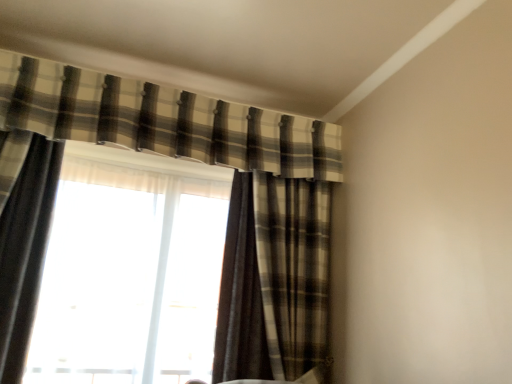
Question: Does brown plaid curtain at center, acting as the 3th curtain starting from the left, have a smaller size compared to plaid fabric curtain at left, arranged as the third curtain when viewed from the right?

Choices:
 (A) no
 (B) yes

Answer: (A)

Question: Does brown plaid curtain at center, acting as the 3th curtain starting from the left, come in front of plaid fabric curtain at left, the 1th curtain when ordered from left to right?

Choices:
 (A) yes
 (B) no

Answer: (B)

Question: Considering the relative positions of brown plaid curtain at center, acting as the 3th curtain starting from the left, and plaid fabric curtain at left, the 1th curtain when ordered from left to right, in the image provided, is brown plaid curtain at center, acting as the 3th curtain starting from the left, behind plaid fabric curtain at left, the 1th curtain when ordered from left to right,?

Choices:
 (A) yes
 (B) no

Answer: (A)

Question: Does brown plaid curtain at center, the 1th curtain when ordered from right to left, have a greater height compared to plaid fabric curtain at left, the 1th curtain when ordered from left to right?

Choices:
 (A) yes
 (B) no

Answer: (B)

Question: From a real-world perspective, is brown plaid curtain at center, acting as the 3th curtain starting from the left, under plaid fabric curtain at left, arranged as the third curtain when viewed from the right?

Choices:
 (A) yes
 (B) no

Answer: (B)

Question: Considering the positions of point (123, 180) and point (31, 208), is point (123, 180) closer or farther from the camera than point (31, 208)?

Choices:
 (A) closer
 (B) farther

Answer: (B)

Question: Considering the positions of translucent fabric at center and plaid fabric curtain at left, the 1th curtain when ordered from left to right, in the image, is translucent fabric at center bigger or smaller than plaid fabric curtain at left, the 1th curtain when ordered from left to right,?

Choices:
 (A) big
 (B) small

Answer: (A)

Question: Is translucent fabric at center inside the boundaries of plaid fabric curtain at left, arranged as the third curtain when viewed from the right, or outside?

Choices:
 (A) outside
 (B) inside

Answer: (A)

Question: In terms of height, does translucent fabric at center look taller or shorter compared to plaid fabric curtain at left, arranged as the third curtain when viewed from the right?

Choices:
 (A) tall
 (B) short

Answer: (B)

Question: From the image's perspective, is plaid fabric curtain at upper center, marked as the 2th curtain in a left-to-right arrangement, above or below brown plaid curtain at center, the 1th curtain when ordered from right to left?

Choices:
 (A) above
 (B) below

Answer: (A)

Question: Based on their positions, is plaid fabric curtain at upper center, marked as the 2th curtain in a left-to-right arrangement, located to the left or right of brown plaid curtain at center, the 1th curtain when ordered from right to left?

Choices:
 (A) left
 (B) right

Answer: (A)

Question: Looking at the image, does plaid fabric curtain at upper center, marked as the 2th curtain in a left-to-right arrangement, seem bigger or smaller compared to brown plaid curtain at center, acting as the 3th curtain starting from the left?

Choices:
 (A) big
 (B) small

Answer: (B)

Question: Which is correct: plaid fabric curtain at upper center, which is counted as the 2th curtain, starting from the right, is inside brown plaid curtain at center, acting as the 3th curtain starting from the left, or outside of it?

Choices:
 (A) outside
 (B) inside

Answer: (A)

Question: From a real-world perspective, is brown plaid curtain at center, the 1th curtain when ordered from right to left, above or below plaid fabric curtain at upper center, marked as the 2th curtain in a left-to-right arrangement?

Choices:
 (A) above
 (B) below

Answer: (B)

Question: From the image's perspective, is brown plaid curtain at center, acting as the 3th curtain starting from the left, positioned above or below plaid fabric curtain at upper center, marked as the 2th curtain in a left-to-right arrangement?

Choices:
 (A) below
 (B) above

Answer: (A)